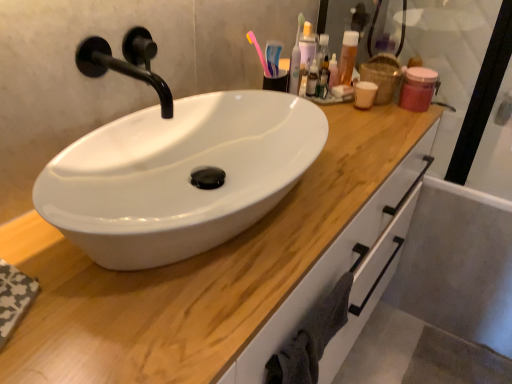
Question: From the image's perspective, is translucent plastic bottle at upper right located beneath wooden at center?

Choices:
 (A) yes
 (B) no

Answer: (B)

Question: From a real-world perspective, is translucent plastic bottle at upper right under wooden at center?

Choices:
 (A) no
 (B) yes

Answer: (A)

Question: Is translucent plastic bottle at upper right surrounding wooden at center?

Choices:
 (A) yes
 (B) no

Answer: (B)

Question: From the image's perspective, is translucent plastic bottle at upper right above wooden at center?

Choices:
 (A) no
 (B) yes

Answer: (B)

Question: Is the depth of translucent plastic bottle at upper right less than that of wooden at center?

Choices:
 (A) no
 (B) yes

Answer: (A)

Question: Considering their positions, is translucent plastic bottle at upper right located in front of or behind white glossy drawer at right?

Choices:
 (A) front
 (B) behind

Answer: (B)

Question: Considering the positions of translucent plastic bottle at upper right and white glossy drawer at right in the image, is translucent plastic bottle at upper right taller or shorter than white glossy drawer at right?

Choices:
 (A) tall
 (B) short

Answer: (B)

Question: Based on their sizes in the image, would you say translucent plastic bottle at upper right is bigger or smaller than white glossy drawer at right?

Choices:
 (A) small
 (B) big

Answer: (A)

Question: In terms of width, does translucent plastic bottle at upper right look wider or thinner when compared to white glossy drawer at right?

Choices:
 (A) wide
 (B) thin

Answer: (B)

Question: From their relative heights in the image, would you say wooden at center is taller or shorter than gray cotton towel at lower right?

Choices:
 (A) short
 (B) tall

Answer: (B)

Question: From a real-world perspective, is wooden at center above or below gray cotton towel at lower right?

Choices:
 (A) below
 (B) above

Answer: (A)

Question: Is wooden at center inside or outside of gray cotton towel at lower right?

Choices:
 (A) outside
 (B) inside

Answer: (A)

Question: Visually, is wooden at center positioned to the left or to the right of gray cotton towel at lower right?

Choices:
 (A) left
 (B) right

Answer: (A)

Question: Is white glossy drawer at right taller or shorter than black matte faucet at upper left?

Choices:
 (A) tall
 (B) short

Answer: (A)

Question: From the image's perspective, is white glossy drawer at right positioned above or below black matte faucet at upper left?

Choices:
 (A) above
 (B) below

Answer: (B)